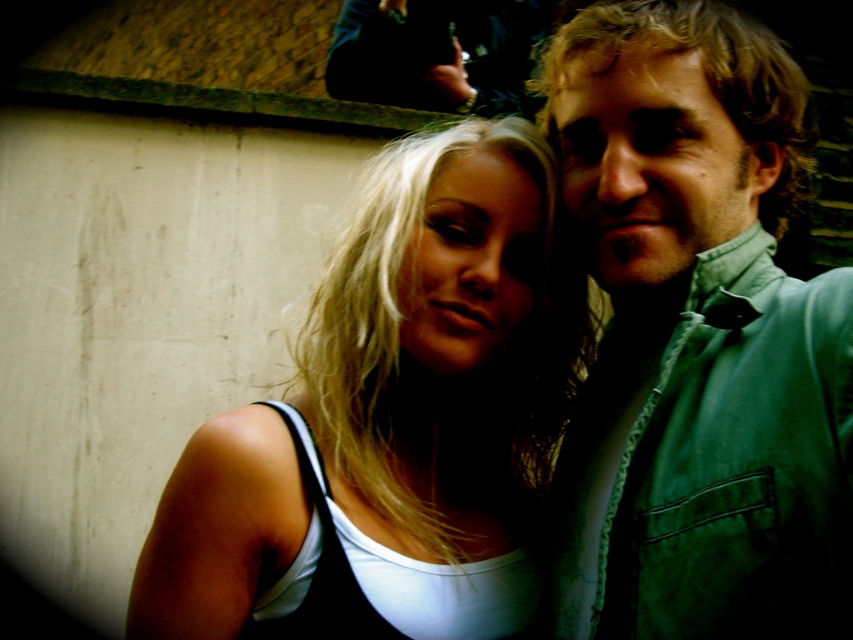
You are a photographer trying to focus on the white matte tank top at center and the green textured shirt at right. Which one should you adjust your camera focus to first if you want to capture both clearly?

You should focus on the green textured shirt at right first because it is closer to the viewer than the white matte tank top at center, so adjusting focus starting from the closer object ensures both are in focus.

You are a photographer trying to capture the two people in the scene. The green textured shirt at right is located at point (695, 339). Where should you position your camera relative to the two people to ensure the green textured shirt at right is centered in the frame?

To center the green textured shirt at right in the frame, position the camera so that the point (695, 339) is at the center of the viewfinder. This ensures the green textured shirt at right is centered while still including both individuals in the shot.